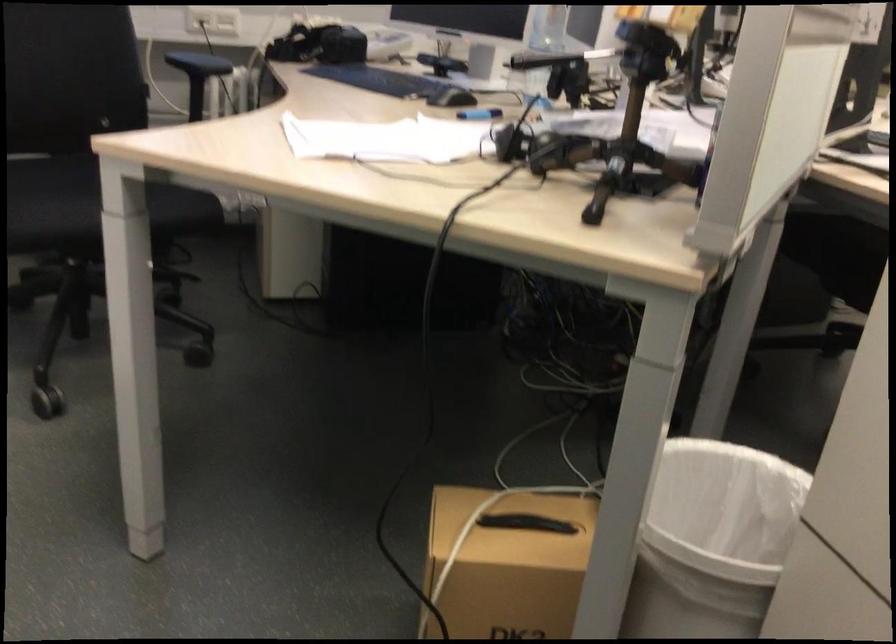
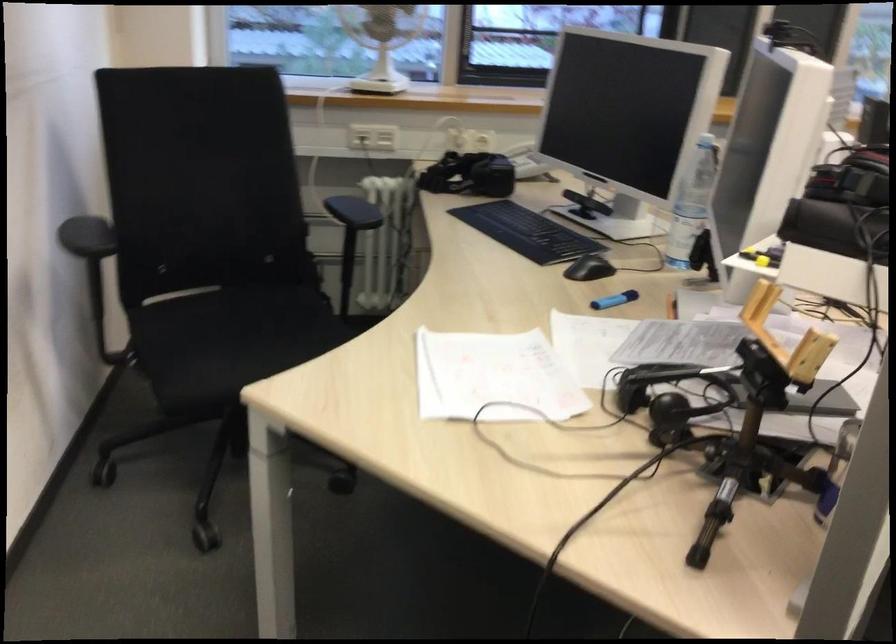
Find the pixel in the second image that matches point (543, 152) in the first image.

(672, 389)